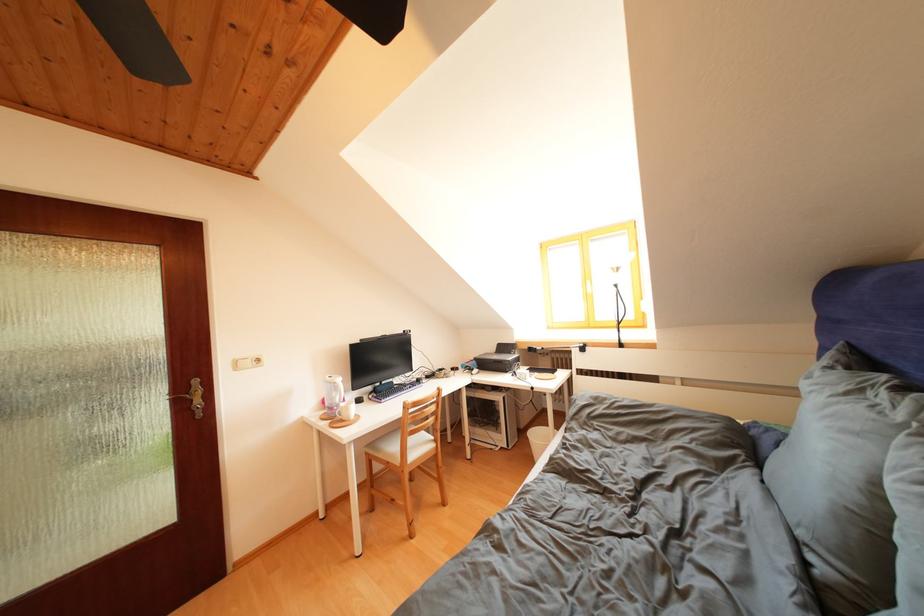
Find the location of `brass door handle`. brass door handle is located at coordinates (193, 397).